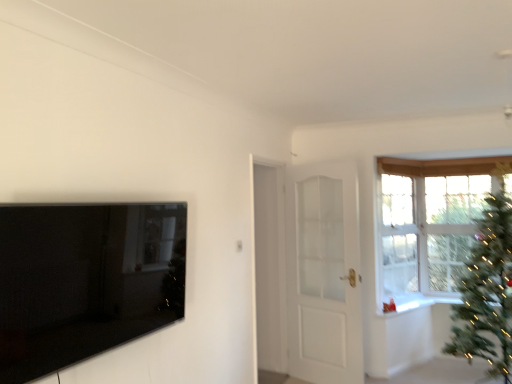
This screenshot has width=512, height=384. In order to click on green matte christmas tree at right in this screenshot , I will do `click(487, 287)`.

Is white glossy door at center taller than white glossy window sill at upper right?

Correct, white glossy door at center is much taller as white glossy window sill at upper right.

Looking at the image, does white glossy door at center seem bigger or smaller compared to white glossy window sill at upper right?

In the image, white glossy door at center appears to be larger than white glossy window sill at upper right.

Considering the relative sizes of white glossy door at center and white glossy window sill at upper right in the image provided, is white glossy door at center wider than white glossy window sill at upper right?

No.

Can we say white glossy door at center lies outside white glossy window sill at upper right?

Yes, white glossy door at center is outside of white glossy window sill at upper right.

Does white glossy door at center have a smaller size compared to clear glass window at upper right?

No.

Would you say white glossy door at center is a long distance from clear glass window at upper right?

Actually, white glossy door at center and clear glass window at upper right are a little close together.

Considering the points (354, 333) and (392, 186), which point is in front, point (354, 333) or point (392, 186)?

Positioned in front is point (354, 333).

Does white glossy door at center contain clear glass window at upper right?

Actually, clear glass window at upper right is outside white glossy door at center.

Does white glossy door at center lie in front of white glossy door at center?

Yes, it is in front of white glossy door at center.

Does white glossy door at center turn towards white glossy door at center?

Yes, white glossy door at center is oriented towards white glossy door at center.

Is point (263, 356) positioned after point (296, 346)?

Yes, point (263, 356) is behind point (296, 346).

How far apart are white glossy door at center and white glossy door at center?

The distance of white glossy door at center from white glossy door at center is 13.06 inches.

Is point (492, 374) positioned behind point (385, 188)?

No, it is in front of (385, 188).

Measure the distance from green matte christmas tree at right to clear glass window at upper right.

They are 90.07 centimeters apart.

Is green matte christmas tree at right with clear glass window at upper right?

green matte christmas tree at right is not next to clear glass window at upper right, and they're not touching.

Which is correct: black glossy tv at left is inside white glossy door at center, or outside of it?

black glossy tv at left is spatially situated outside white glossy door at center.

Who is shorter, black glossy tv at left or white glossy door at center?

Standing shorter between the two is black glossy tv at left.

Can you confirm if black glossy tv at left is thinner than white glossy door at center?

Yes.

Between black glossy tv at left and white glossy door at center, which one appears on the right side from the viewer's perspective?

From the viewer's perspective, white glossy door at center appears more on the right side.

From a real-world perspective, is black glossy tv at left located beneath green matte christmas tree at right?

Incorrect, from a real-world perspective, black glossy tv at left is higher than green matte christmas tree at right.

Is black glossy tv at left to the left of green matte christmas tree at right from the viewer's perspective?

Yes.

Which is behind, point (59, 260) or point (457, 327)?

Positioned behind is point (457, 327).

Which object is thinner, white glossy door at center or black glossy tv at left?

With smaller width is black glossy tv at left.

Does white glossy door at center touch black glossy tv at left?

No, white glossy door at center is not in contact with black glossy tv at left.

From the image's perspective, which is above, white glossy door at center or black glossy tv at left?

black glossy tv at left appears higher in the image.

Which object is positioned more to the left, white glossy door at center or black glossy tv at left?

Positioned to the left is black glossy tv at left.

The height and width of the screenshot is (384, 512). What are the coordinates of `door above the white glossy window sill at upper right (from the image's perspective)` in the screenshot? It's located at (323, 273).

Image resolution: width=512 pixels, height=384 pixels. What are the coordinates of `door located underneath the clear glass window at upper right (from a real-world perspective)` in the screenshot? It's located at (323, 273).

Which object lies further to the anchor point clear glass window at upper right, white glossy door at center or black glossy tv at left?

Among the two, black glossy tv at left is located further to clear glass window at upper right.

Based on their spatial positions, is white glossy window sill at upper right or clear glass window at upper right closer to white glossy door at center?

white glossy window sill at upper right lies closer to white glossy door at center than the other object.

Based on their spatial positions, is white glossy window sill at upper right or white glossy door at center closer to green matte christmas tree at right?

white glossy window sill at upper right lies closer to green matte christmas tree at right than the other object.

Based on their spatial positions, is white glossy door at center or white glossy window sill at upper right closer to white glossy door at center?

white glossy door at center lies closer to white glossy door at center than the other object.

Estimate the real-world distances between objects in this image. Which object is closer to white glossy window sill at upper right, white glossy door at center or clear glass window at upper right?

clear glass window at upper right is positioned closer to the anchor white glossy window sill at upper right.

Looking at the image, which one is located further to white glossy door at center, white glossy window sill at upper right or white glossy door at center?

white glossy window sill at upper right is further to white glossy door at center.

Based on their spatial positions, is green matte christmas tree at right or white glossy door at center further from white glossy window sill at upper right?

white glossy door at center is further to white glossy window sill at upper right.

Considering their positions, is white glossy window sill at upper right positioned closer to black glossy tv at left than white glossy door at center?

white glossy door at center.

Where is `door between white glossy door at center and green matte christmas tree at right in the horizontal direction`? This screenshot has width=512, height=384. door between white glossy door at center and green matte christmas tree at right in the horizontal direction is located at coordinates (323, 273).

Image resolution: width=512 pixels, height=384 pixels. What are the coordinates of `window between white glossy door at center and green matte christmas tree at right from left to right` in the screenshot? It's located at (398, 237).

The image size is (512, 384). I want to click on window sill located between green matte christmas tree at right and clear glass window at upper right in the depth direction, so click(x=405, y=303).

Find the location of `door located between black glossy tv at left and clear glass window at upper right in the depth direction`. door located between black glossy tv at left and clear glass window at upper right in the depth direction is located at coordinates (323, 273).